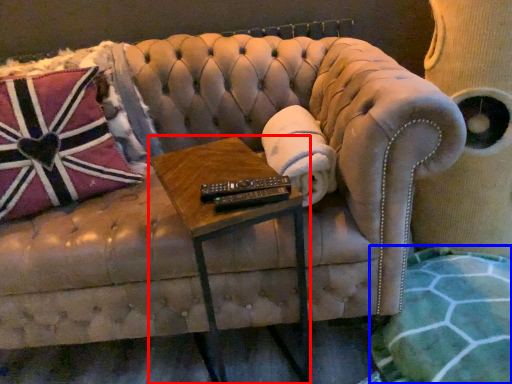
Question: Among these objects, which one is farthest to the camera, table (highlighted by a red box) or blanket (highlighted by a blue box)?

Choices:
 (A) table
 (B) blanket

Answer: (B)